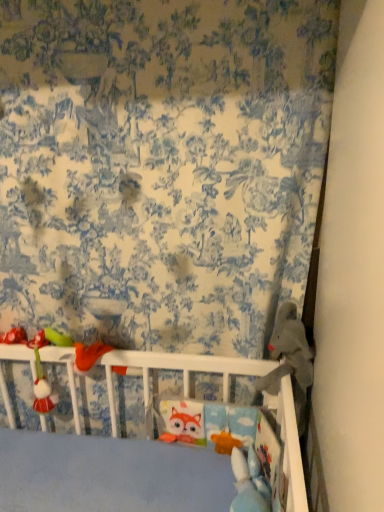
Question: Is gray plush bear at right, arranged as the second toy when viewed from the left, to the left or to the right of matte plastic rattle at left, which appears as the second toy when viewed from the right, in the image?

Choices:
 (A) left
 (B) right

Answer: (B)

Question: Is gray plush bear at right, arranged as the second toy when viewed from the left, wider or thinner than matte plastic rattle at left, which appears as the second toy when viewed from the right?

Choices:
 (A) thin
 (B) wide

Answer: (B)

Question: Which object is the farthest from the gray plush bear at right, which is the 1th toy in right-to-left order?

Choices:
 (A) blue printed fabric at upper center
 (B) matte plastic rattle at left, which appears as the first toy when viewed from the left

Answer: (B)

Question: Considering the real-world distances, which object is farthest from the blue printed fabric at upper center?

Choices:
 (A) gray plush bear at right, arranged as the second toy when viewed from the left
 (B) matte plastic rattle at left, which appears as the second toy when viewed from the right

Answer: (B)